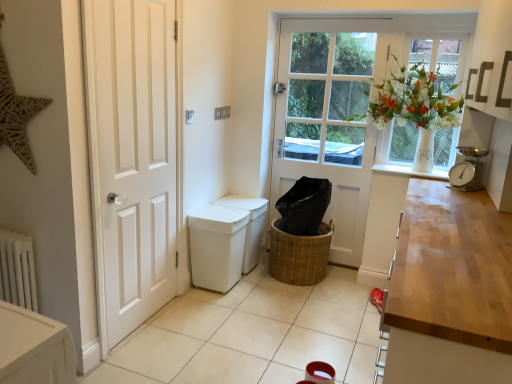
The image size is (512, 384). I want to click on free space in front of woven brown basket at center, so click(x=300, y=307).